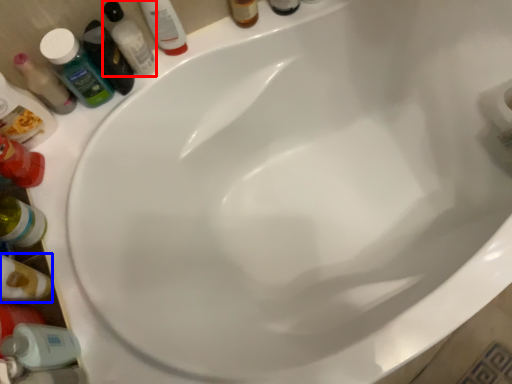
Question: Which of the following is the farthest to the observer, mouthwash (highlighted by a red box) or bottle (highlighted by a blue box)?

Choices:
 (A) mouthwash
 (B) bottle

Answer: (A)